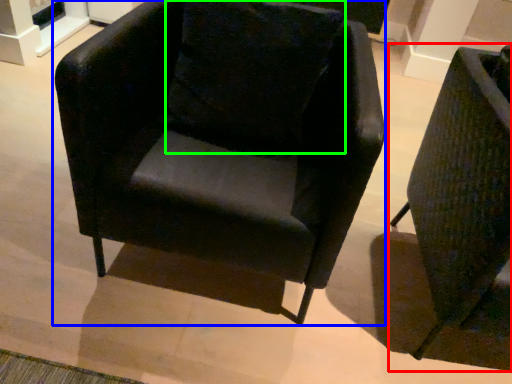
Question: Which object is positioned closest to chair (highlighted by a red box)? Select from chair (highlighted by a blue box) and pillow (highlighted by a green box).

Choices:
 (A) chair
 (B) pillow

Answer: (A)